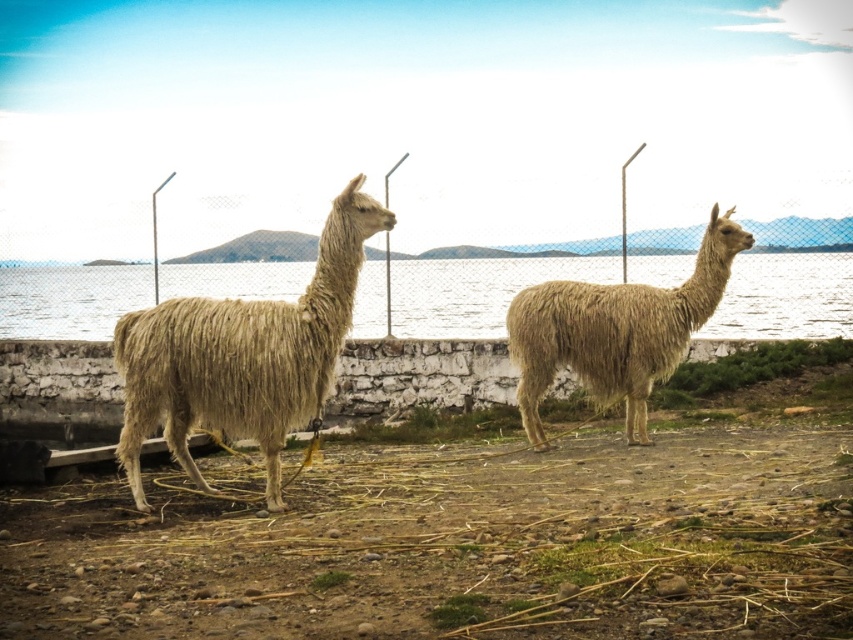
Question: Which of the following is the closest to the observer?

Choices:
 (A) (206, 292)
 (B) (189, 384)

Answer: (B)

Question: Which object is closer to the camera taking this photo?

Choices:
 (A) beige woolen alpaca at right
 (B) clear blue water at center
 (C) light beige woolen alpaca at center

Answer: (C)

Question: Is clear blue water at center above beige woolen alpaca at right?

Choices:
 (A) no
 (B) yes

Answer: (B)

Question: Is light beige woolen alpaca at center closer to camera compared to beige woolen alpaca at right?

Choices:
 (A) no
 (B) yes

Answer: (B)

Question: Which object is farther from the camera taking this photo?

Choices:
 (A) beige woolen alpaca at right
 (B) light beige woolen alpaca at center

Answer: (A)

Question: Is light beige woolen alpaca at center further to camera compared to beige woolen alpaca at right?

Choices:
 (A) yes
 (B) no

Answer: (B)